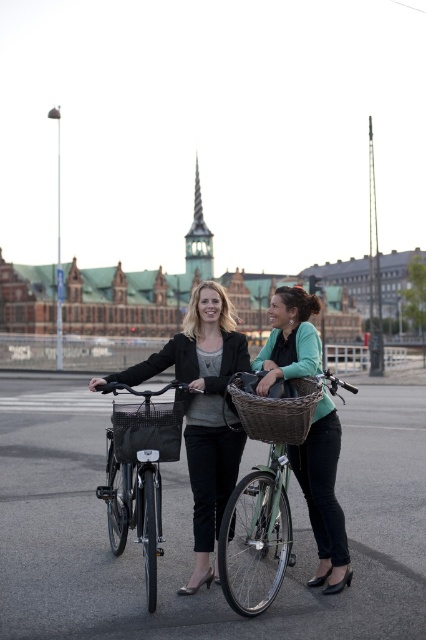
You are a delivery person who needs to place the matte green bicycle at center and the black woven basket at center into a storage container that can only fit items up to 1.2 meters wide. Based on the scene description, will both items fit?

The matte green bicycle at center is wider than the black woven basket at center. However, since the storage container can only accommodate items up to 1.2 meters wide, we need to know the exact width of the bicycle to determine if it fits. Unfortunately, the scene description does not provide specific measurements for either item. Therefore, it is impossible to confirm if both items will fit into the storage container based on the given information.

You are a delivery drone trying to fly through the space between the two points, point (333,545) and point (276,424). According to the image, which point is closer to you so you can plan your flight path?

Point (276,424) is closer to you than point (333,545), so you should aim for that point first in your flight path.